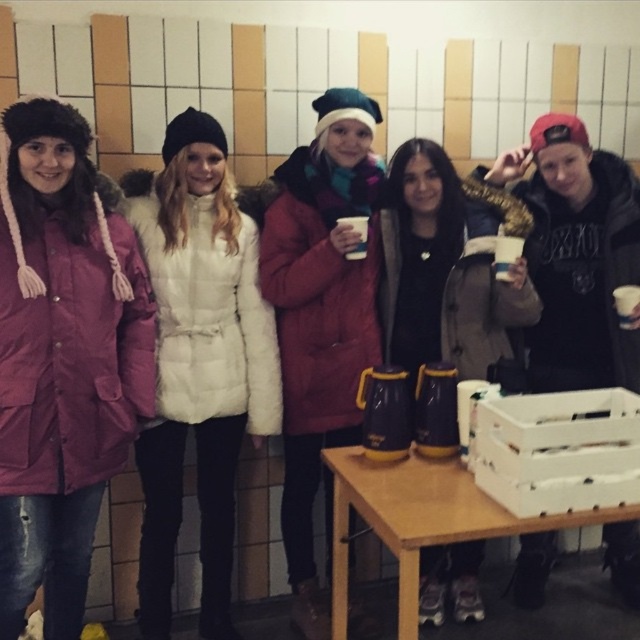
Question: Considering the relative positions of matte pink coat at left and black fuzzy hat at upper right in the image provided, where is matte pink coat at left located with respect to black fuzzy hat at upper right?

Choices:
 (A) above
 (B) below

Answer: (B)

Question: Which point appears closest to the camera in this image?

Choices:
 (A) (621, 220)
 (B) (394, 157)

Answer: (A)

Question: Which point is farther to the camera?

Choices:
 (A) (369, 356)
 (B) (506, 480)
 (C) (134, 266)

Answer: (A)

Question: Which point is closer to the camera?

Choices:
 (A) black fuzzy hat at upper right
 (B) white fur coat at center
 (C) wooden table at lower center
 (D) white plastic crate at lower right

Answer: (C)

Question: Can you confirm if matte pink coat at left is positioned above matte black boots at center?

Choices:
 (A) no
 (B) yes

Answer: (A)

Question: Is matte red coat at center thinner than white plastic crate at lower right?

Choices:
 (A) yes
 (B) no

Answer: (B)